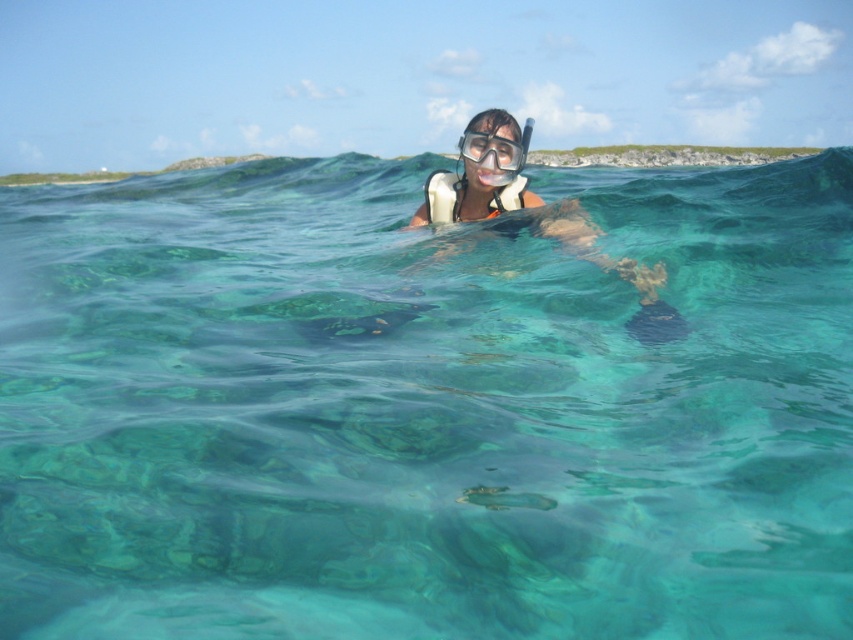
You are a lifeguard observing a snorkeler in the water. You notice the clear plastic snorkel at center and the clear plastic goggles at center. Which of these items is positioned higher relative to the other?

The clear plastic snorkel at center is located above the clear plastic goggles at center.

You are a snorkeler who wants to adjust your gear. You have a clear plastic snorkel at center and a clear plastic goggles at center. If your hand can reach 8 inches, can you comfortably reach both items at the same time?

The clear plastic snorkel at center is 7.65 inches from clear plastic goggles at center, so yes, you can comfortably reach both items at the same time since the distance between them is within your hand reach of 8 inches.

The snorkeler is trying to adjust their equipment. Which item is located to the right of the other between the clear plastic snorkel at center and the clear plastic goggles at center?

The clear plastic snorkel at center is to the right of the clear plastic goggles at center.